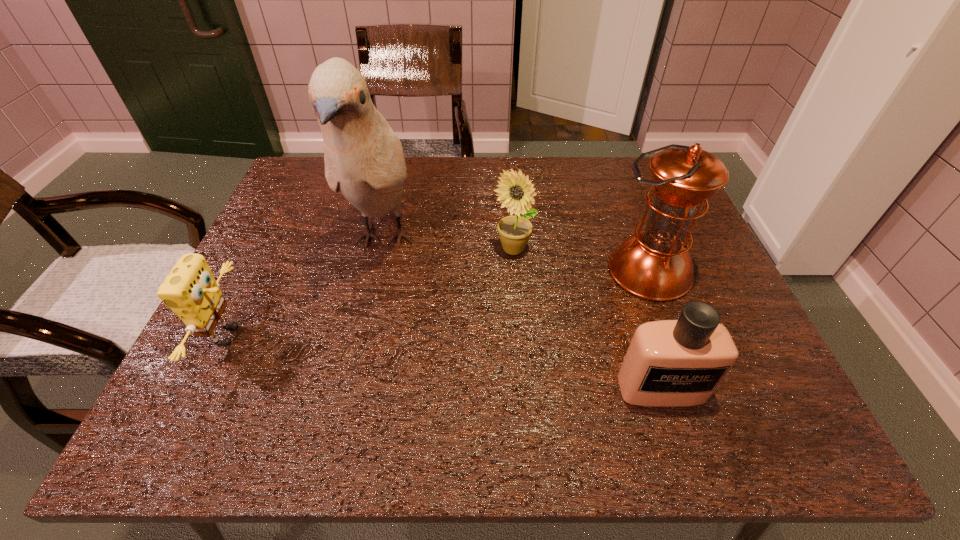
You are a GUI agent. You are given a task and a screenshot of the screen. Output one action in this format:
    pyautogui.click(x=<x>, y=<y>)
    Task: Click on the fourth object from right to left
    The height and width of the screenshot is (540, 960).
    Given the screenshot: What is the action you would take?
    pyautogui.click(x=364, y=159)

Find the location of a particular element. the tallest object is located at coordinates (364, 159).

Locate an element on the screen. oil lamp is located at coordinates (654, 264).

Find the location of `the third object from right to left`. the third object from right to left is located at coordinates (516, 191).

The width and height of the screenshot is (960, 540). In order to click on perfume in this screenshot , I will do `click(670, 363)`.

The image size is (960, 540). In order to click on the leftmost object in this screenshot , I will do `click(190, 290)`.

The height and width of the screenshot is (540, 960). I want to click on free spot located on the face of the parakeet, so click(x=338, y=440).

At what (x,y) coordinates should I click in order to perform the action: click on free spot located 0.180m on the left of the oil lamp. Please return your answer as a coordinate pair (x, y). Looking at the image, I should click on (530, 271).

Where is `free space located on the face of the third object from left to right`? free space located on the face of the third object from left to right is located at coordinates (516, 300).

Where is `free space located 0.050m on the front label of the perfume`? free space located 0.050m on the front label of the perfume is located at coordinates (676, 434).